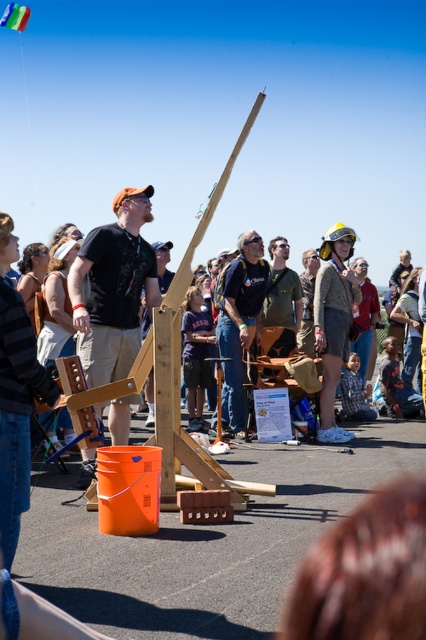
Between matte black shirt at center and multicolored fabric kite at center, which one is positioned lower?

Positioned lower is matte black shirt at center.

In the scene shown: Between matte black shirt at center and multicolored fabric kite at center, which one appears on the left side from the viewer's perspective?

multicolored fabric kite at center is more to the left.

Does point (111, 224) lie in front of point (3, 19)?

Yes, point (111, 224) is in front of point (3, 19).

This screenshot has width=426, height=640. I want to click on matte black shirt at center, so click(x=114, y=289).

Can you confirm if matte blue shirt at center is smaller than multicolored fabric kite at center?

No, matte blue shirt at center is not smaller than multicolored fabric kite at center.

Can you confirm if matte blue shirt at center is bigger than multicolored fabric kite at center?

Yes.

In the scene shown: Who is more distant from viewer, (226,328) or (26,12)?

Point (26,12)

Where is `matte blue shirt at center`? Image resolution: width=426 pixels, height=640 pixels. matte blue shirt at center is located at coordinates (239, 320).

From the picture: Between matte black shirt at center and matte green shirt at center, which one is positioned lower?

matte black shirt at center is lower down.

Between matte black shirt at center and matte green shirt at center, which one is positioned higher?

matte green shirt at center

What do you see at coordinates (114, 289) in the screenshot?
I see `matte black shirt at center` at bounding box center [114, 289].

What are the coordinates of `matte black shirt at center` in the screenshot? It's located at (114, 289).